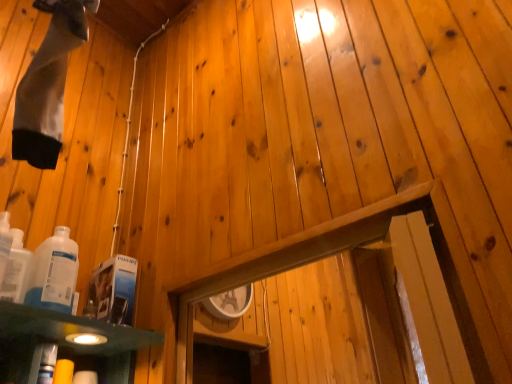
Question: Is white glossy bottle at lower left, the second bottle in the left-to-right sequence, inside the boundaries of white glossy bottle at lower left, which appears as the second bottle when viewed from the right, or outside?

Choices:
 (A) outside
 (B) inside

Answer: (A)

Question: From a real-world perspective, relative to white glossy bottle at lower left, which appears as the second bottle when viewed from the right, is white glossy bottle at lower left, the second bottle in the left-to-right sequence, vertically above or below?

Choices:
 (A) above
 (B) below

Answer: (B)

Question: Based on their positions, is white glossy bottle at lower left, which is the 1th bottle in right-to-left order, located to the left or right of white glossy bottle at lower left, placed as the 1th bottle when sorted from left to right?

Choices:
 (A) right
 (B) left

Answer: (A)

Question: Choose the correct answer: Is white glossy bottle at lower left, placed as the 1th bottle when sorted from left to right, inside white glossy bottle at lower left, the second bottle in the left-to-right sequence, or outside it?

Choices:
 (A) outside
 (B) inside

Answer: (A)

Question: Considering the relative positions of white glossy bottle at lower left, placed as the 1th bottle when sorted from left to right, and white glossy bottle at lower left, the second bottle in the left-to-right sequence, in the image provided, is white glossy bottle at lower left, placed as the 1th bottle when sorted from left to right, to the left or to the right of white glossy bottle at lower left, the second bottle in the left-to-right sequence,?

Choices:
 (A) right
 (B) left

Answer: (B)

Question: Is white glossy bottle at lower left, placed as the 1th bottle when sorted from left to right, wider or thinner than white glossy bottle at lower left, which is the 1th bottle in right-to-left order?

Choices:
 (A) thin
 (B) wide

Answer: (A)

Question: From the image's perspective, is white glossy bottle at lower left, placed as the 1th bottle when sorted from left to right, positioned above or below white glossy bottle at lower left, which is the 1th bottle in right-to-left order?

Choices:
 (A) below
 (B) above

Answer: (B)